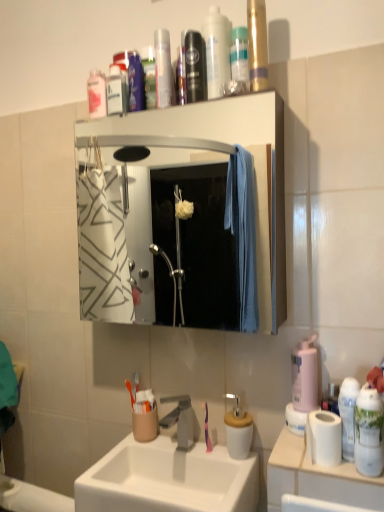
Locate an element on the screen. The image size is (384, 512). vacant space that is to the left of purple glossy toothbrush at sink is located at coordinates (172, 448).